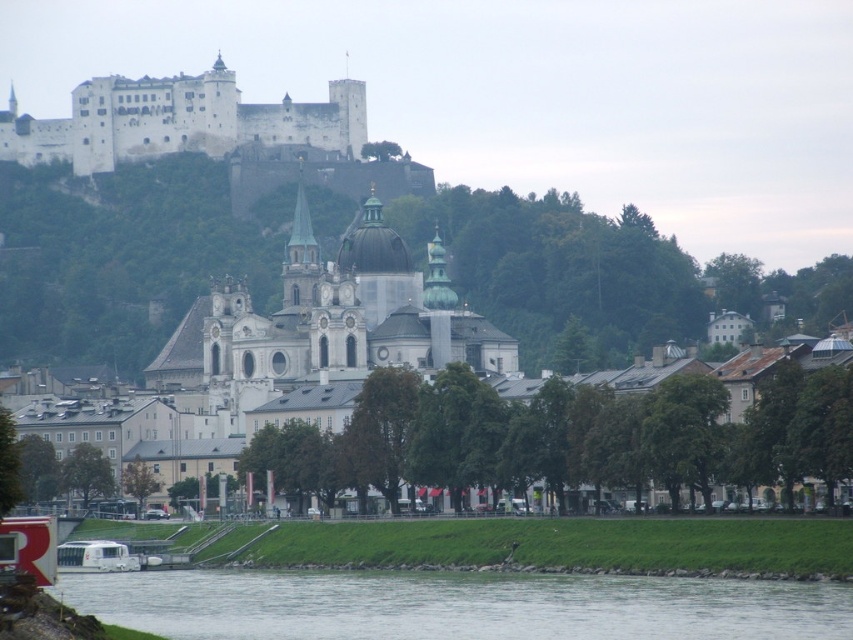
Does clear water at lower center have a larger size compared to white stone castle at upper left?

No, clear water at lower center is not bigger than white stone castle at upper left.

How distant is clear water at lower center from white stone castle at upper left?

A distance of 162.97 meters exists between clear water at lower center and white stone castle at upper left.

In order to click on clear water at lower center in this screenshot , I will do `click(457, 605)`.